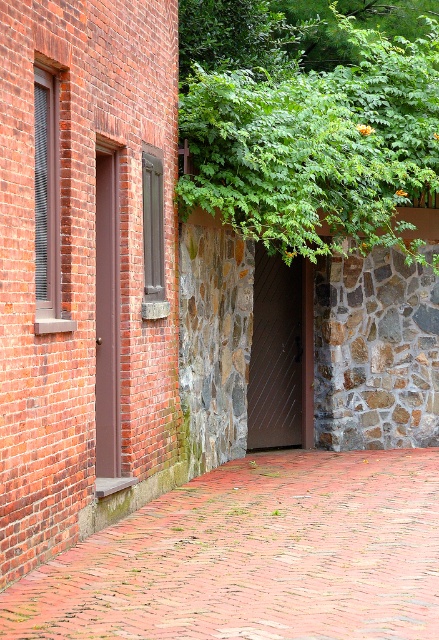
From the picture: You are a delivery person trying to reach the entrance of the building. You see two doors in the image, the brown metal door at center and the brown matte door at left. Which door is taller and more likely to be the main entrance?

The brown matte door at left is taller than the brown metal door at center. In many architectural designs, taller doors are often designated as main entrances for accessibility and prominence. Therefore, the brown matte door at left is more likely to be the main entrance.

You are standing in front of the brown metal door at center and want to enter the building. However, there is a green leafy tree at upper center blocking your view. Can you see the door clearly?

The green leafy tree at upper center is positioned over the brown metal door at center, so it might block your view of the door. You may need to move to the side or look around the tree to see the door clearly.